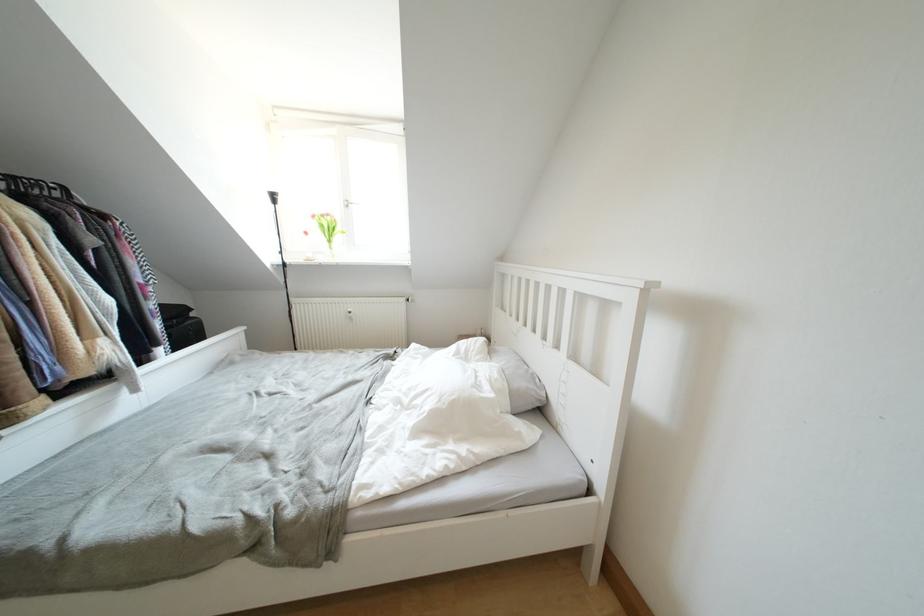
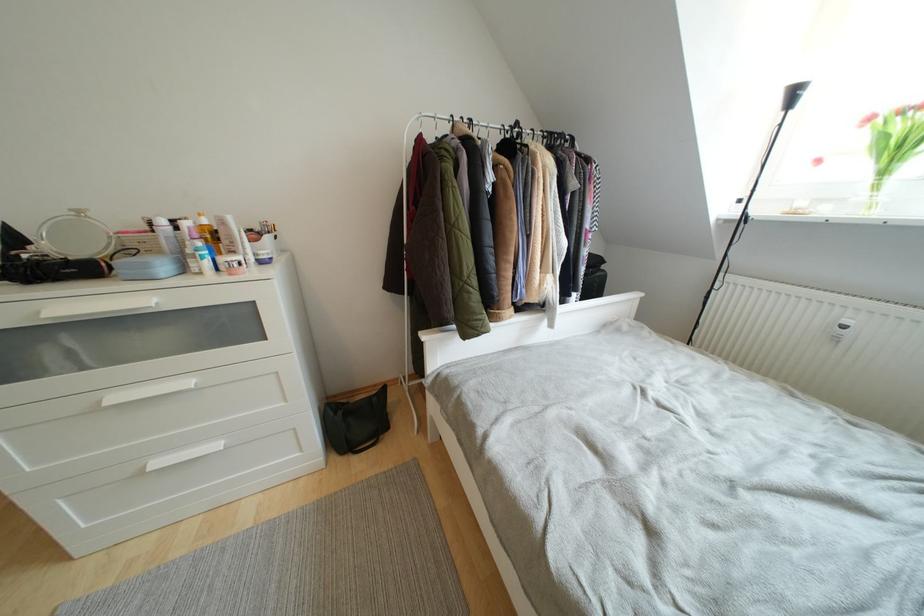
The first image is from the beginning of the video and the second image is from the end. How did the camera likely rotate when shooting the video?

The camera's rotation is toward left-down.